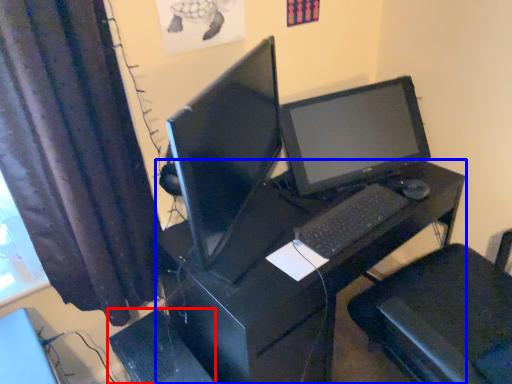
Question: Which point is closer to the camera, computer tower (highlighted by a red box) or desk (highlighted by a blue box)?

Choices:
 (A) computer tower
 (B) desk

Answer: (B)